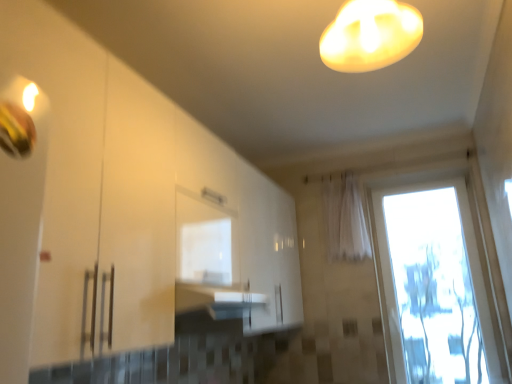
The width and height of the screenshot is (512, 384). Find the location of `free point above transparent glass door at right (from a real-world perspective)`. free point above transparent glass door at right (from a real-world perspective) is located at coordinates (416, 177).